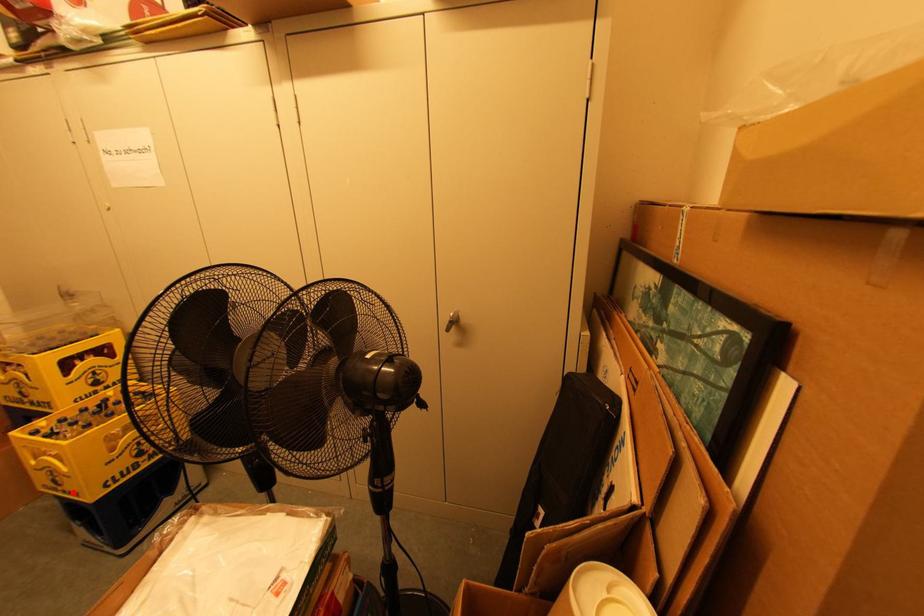
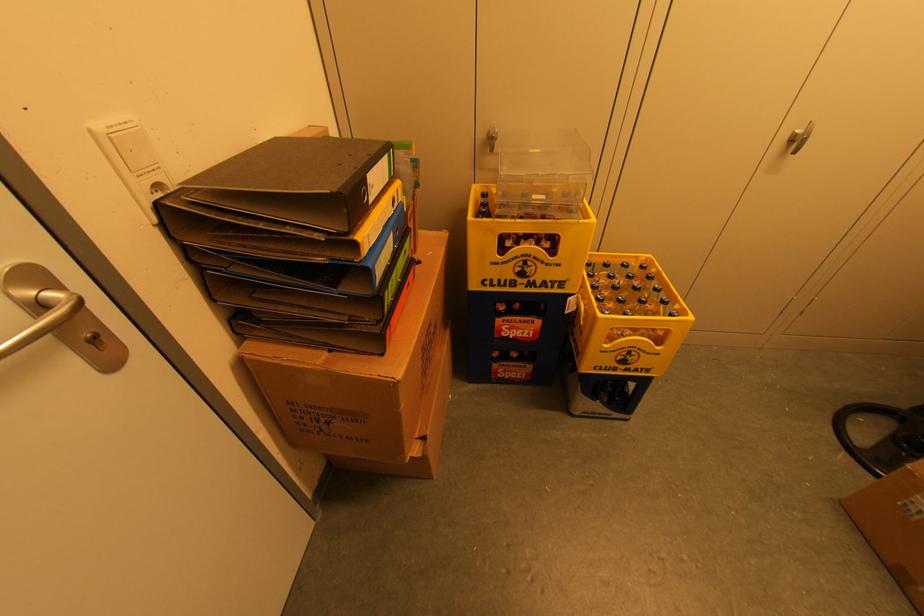
Locate, in the second image, the point that corresponds to the highlighted location in the first image.

(638, 370)